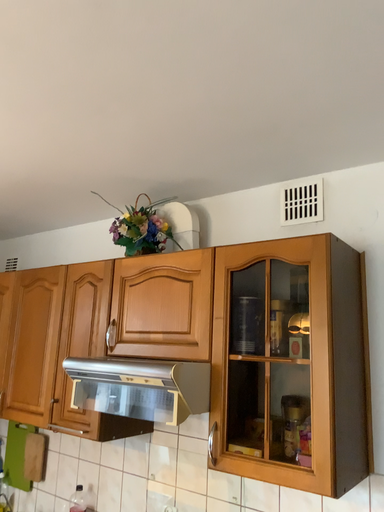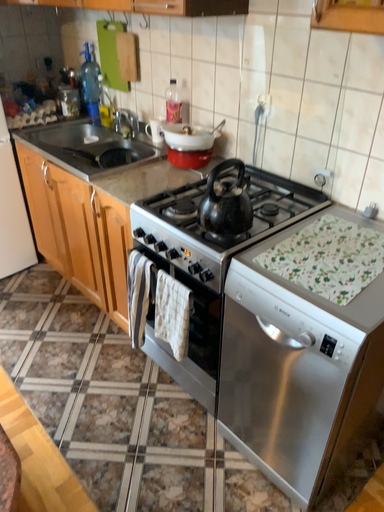
Question: Which way did the camera rotate in the video?

Choices:
 (A) rotated downward
 (B) rotated upward

Answer: (A)